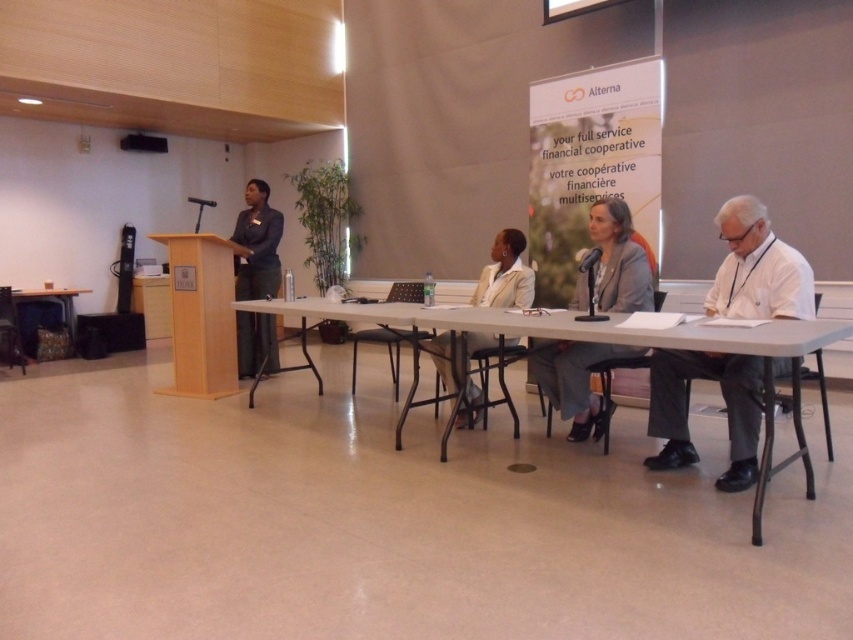
Based on the photo, between white paper at right and gray fabric jacket at center, which one is positioned higher?

Positioned higher is gray fabric jacket at center.

Does white paper at right have a lesser width compared to gray fabric jacket at center?

Indeed, white paper at right has a lesser width compared to gray fabric jacket at center.

Who is more forward, (x=688, y=465) or (x=548, y=368)?

Point (x=688, y=465)

Identify the location of white paper at right. (686, 410).

Is white paper at right closer to camera compared to dark blue fabric jacket at left?

Yes, white paper at right is closer to the viewer.

Does white paper at right have a smaller size compared to dark blue fabric jacket at left?

Indeed, white paper at right has a smaller size compared to dark blue fabric jacket at left.

Locate an element on the screen. white paper at right is located at coordinates (686, 410).

You are a GUI agent. You are given a task and a screenshot of the screen. Output one action in this format:
    pyautogui.click(x=<x>, y=<y>)
    Task: Click on the white paper at right
    
    Given the screenshot: What is the action you would take?
    pyautogui.click(x=686, y=410)

From the picture: Is gray fabric jacket at center to the left of dark blue fabric jacket at left from the viewer's perspective?

Incorrect, gray fabric jacket at center is not on the left side of dark blue fabric jacket at left.

Who is higher up, gray fabric jacket at center or dark blue fabric jacket at left?

dark blue fabric jacket at left is above.

Where is `gray fabric jacket at center`? This screenshot has width=853, height=640. gray fabric jacket at center is located at coordinates (614, 262).